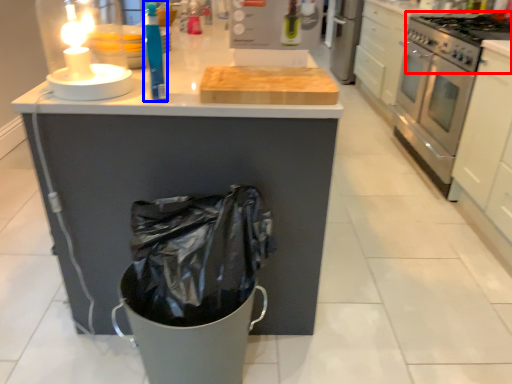
Question: Which of the following is the farthest to the observer, gas stove (highlighted by a red box) or cleaning product (highlighted by a blue box)?

Choices:
 (A) gas stove
 (B) cleaning product

Answer: (A)